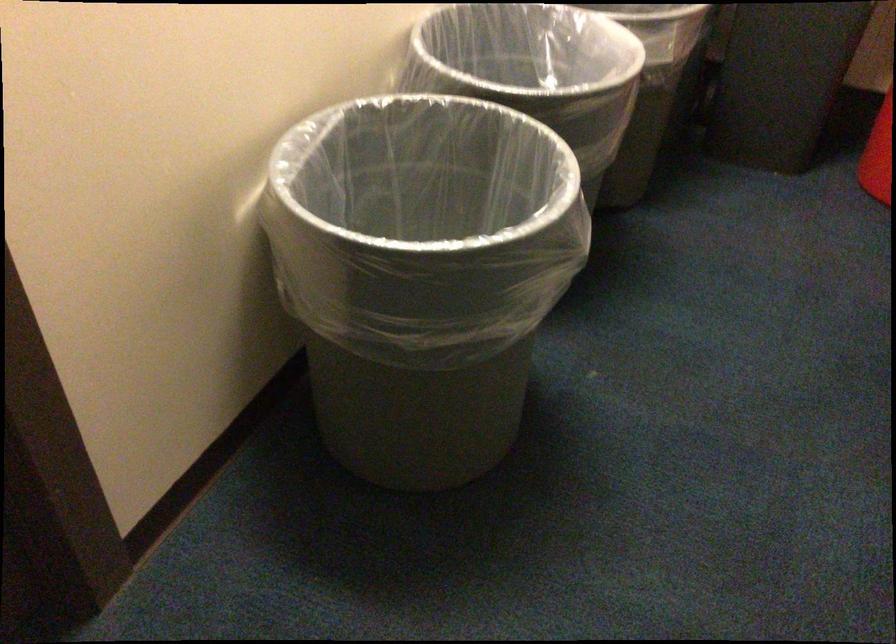
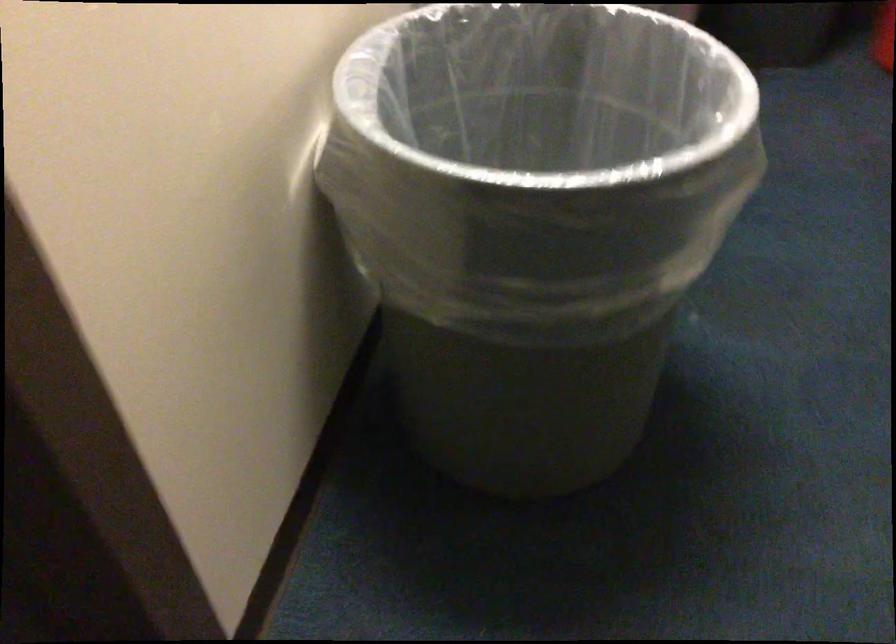
Question: The first image is from the beginning of the video and the second image is from the end. How did the camera likely rotate when shooting the video?

Choices:
 (A) Left
 (B) Right
 (C) Up
 (D) Down

Answer: (B)